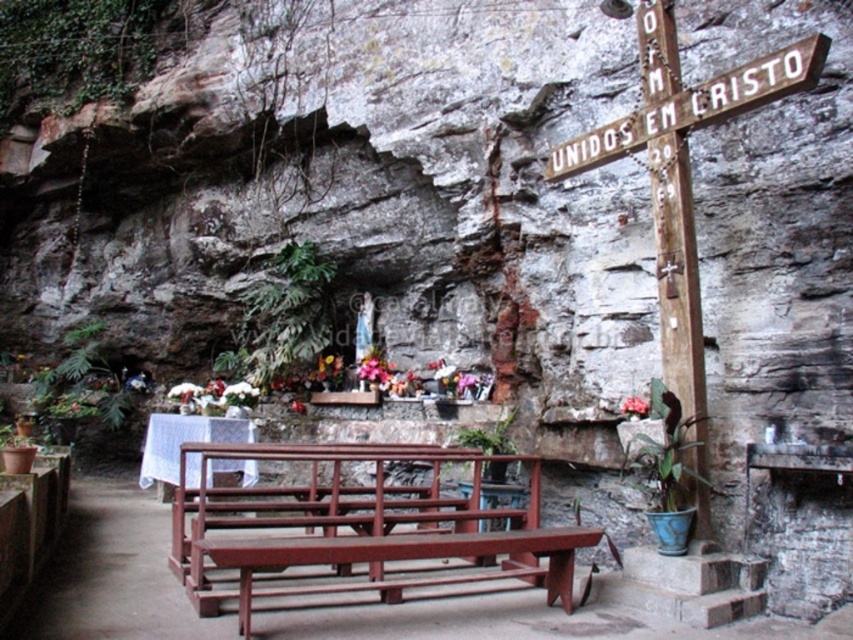
Question: Does wooden cross at upper right appear under wooden picnic table at center?

Choices:
 (A) yes
 (B) no

Answer: (B)

Question: Is wooden cross at right positioned at the back of wooden cross at upper right?

Choices:
 (A) no
 (B) yes

Answer: (B)

Question: Among these points, which one is farthest from the camera?

Choices:
 (A) (647, 8)
 (B) (204, 604)
 (C) (648, 84)
 (D) (642, 403)

Answer: (D)

Question: Which of the following is the closest to the observer?

Choices:
 (A) (621, 408)
 (B) (207, 465)

Answer: (A)

Question: Can you confirm if wooden cross at upper right is positioned above wooden picnic table at center?

Choices:
 (A) yes
 (B) no

Answer: (A)

Question: Which of the following is the farthest from the observer?

Choices:
 (A) (201, 435)
 (B) (802, 70)
 (C) (637, 403)

Answer: (A)